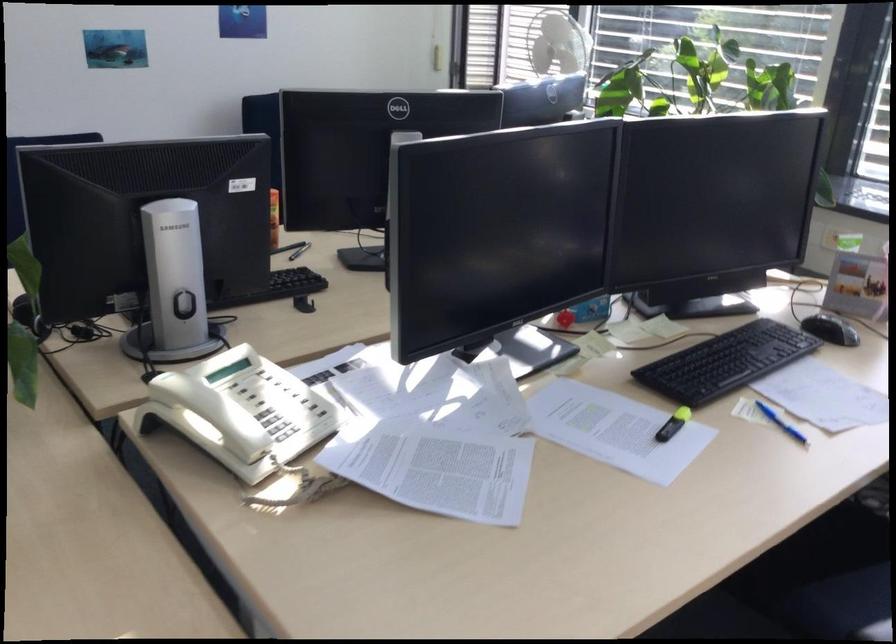
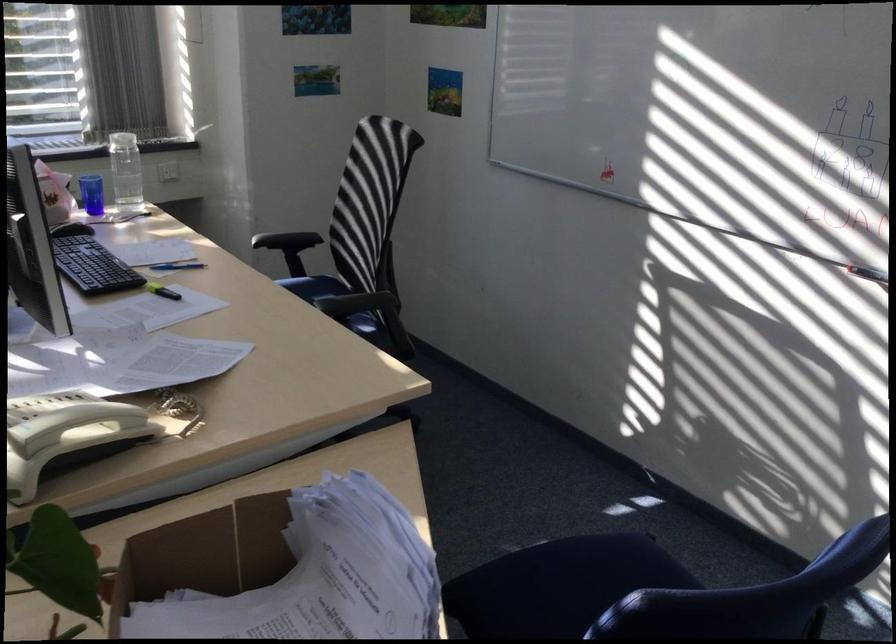
Where in the second image is the point corresponding to (x=184, y=402) from the first image?

(62, 418)